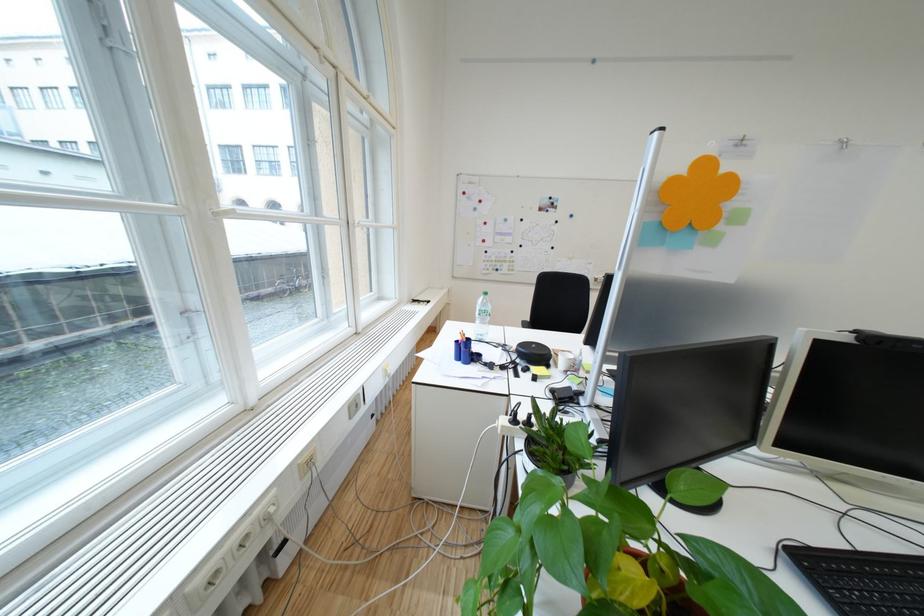
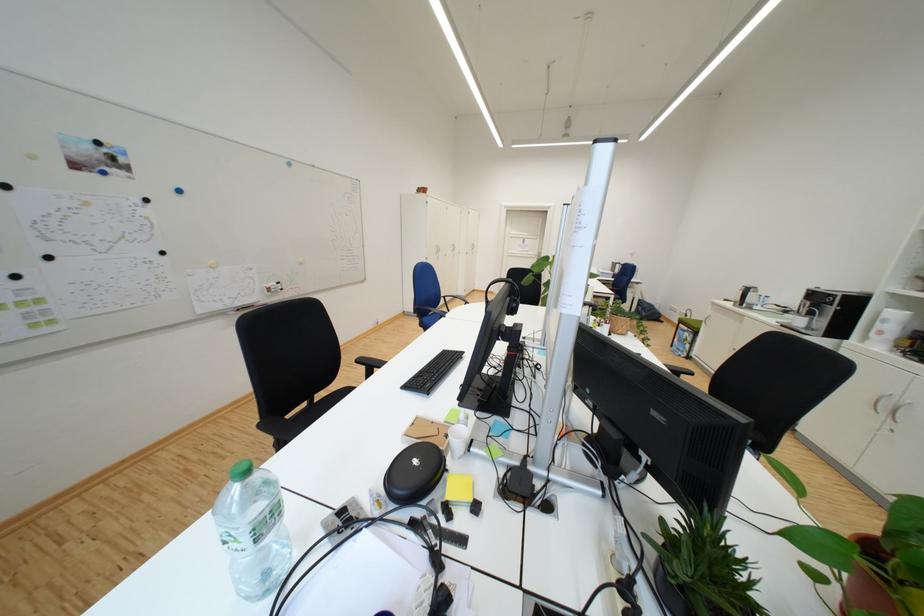
How did the camera likely rotate?

The camera rotated toward right-down.